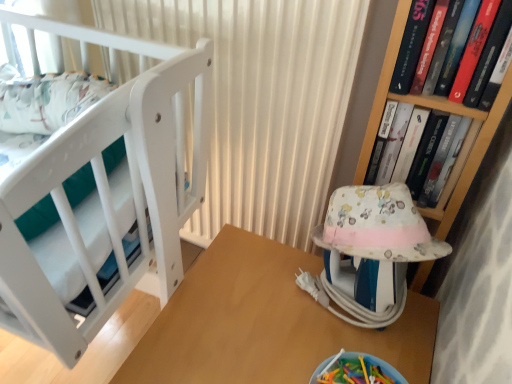
Question: Is hardcover book at upper right, the first book in the front-to-back sequence, at the right side of hardcover book at upper right, the first book from the back?

Choices:
 (A) yes
 (B) no

Answer: (B)

Question: Is hardcover book at upper right, positioned as the second book in back-to-front order, not inside hardcover book at upper right, the first book from the back?

Choices:
 (A) yes
 (B) no

Answer: (A)

Question: From the image's perspective, is hardcover book at upper right, positioned as the second book in back-to-front order, under hardcover book at upper right, the second book when ordered from front to back?

Choices:
 (A) yes
 (B) no

Answer: (B)

Question: Does hardcover book at upper right, positioned as the second book in back-to-front order, appear on the left side of hardcover book at upper right, the first book from the back?

Choices:
 (A) no
 (B) yes

Answer: (B)

Question: Could hardcover book at upper right, the first book from the back, be considered to be inside hardcover book at upper right, the first book in the front-to-back sequence?

Choices:
 (A) yes
 (B) no

Answer: (B)

Question: Does hardcover book at upper right, positioned as the second book in back-to-front order, lie in front of hardcover book at upper right, the second book when ordered from front to back?

Choices:
 (A) no
 (B) yes

Answer: (B)

Question: Considering the relative positions of white matte curtain at upper center and wooden table at center in the image provided, is white matte curtain at upper center to the left of wooden table at center from the viewer's perspective?

Choices:
 (A) yes
 (B) no

Answer: (A)

Question: Is the depth of white matte curtain at upper center greater than that of wooden table at center?

Choices:
 (A) no
 (B) yes

Answer: (B)

Question: Is white matte curtain at upper center turned away from wooden table at center?

Choices:
 (A) yes
 (B) no

Answer: (B)

Question: Is white matte curtain at upper center not close to wooden table at center?

Choices:
 (A) yes
 (B) no

Answer: (B)

Question: Is white matte curtain at upper center taller than wooden table at center?

Choices:
 (A) no
 (B) yes

Answer: (B)

Question: From a real-world perspective, is white matte curtain at upper center located beneath wooden table at center?

Choices:
 (A) yes
 (B) no

Answer: (B)

Question: Does hardcover book at upper right, the first book in the front-to-back sequence, have a lesser width compared to wooden table at center?

Choices:
 (A) yes
 (B) no

Answer: (A)